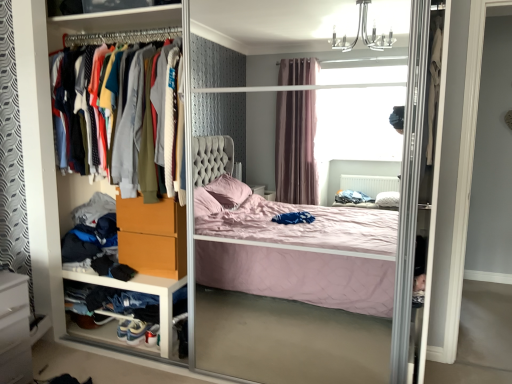
Find the location of a particular element. This screenshot has height=384, width=512. vacant area to the left of white leather shoe at lower left, which ranks as the 1th shoe in right-to-left order is located at coordinates (101, 345).